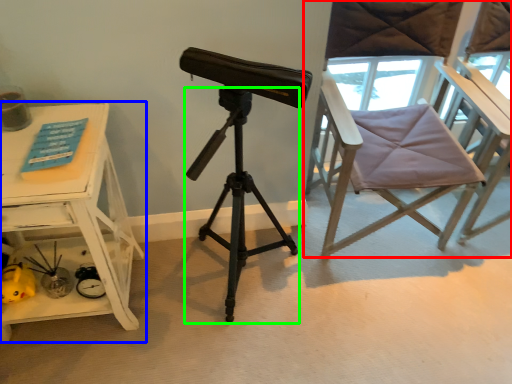
Question: Which object is the closest to the chair (highlighted by a red box)? Choose among these: table (highlighted by a blue box) or tripod (highlighted by a green box).

Choices:
 (A) table
 (B) tripod

Answer: (B)